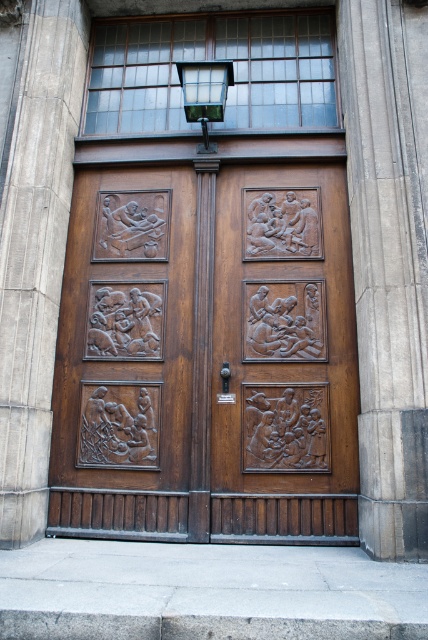
You are an architect inspecting the structure. From your vantage point, which object is closer to you between the matte wood door at center and the gray stone pillar at center?

The matte wood door at center is closer to you because the gray stone pillar at center is positioned behind it.